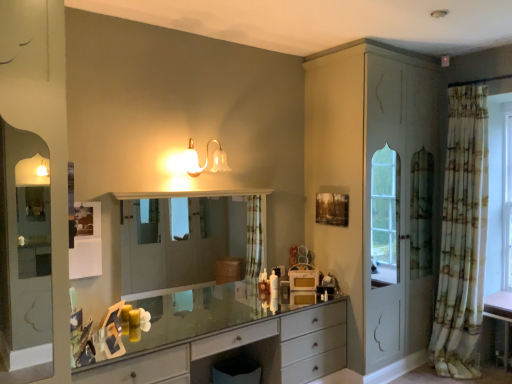
This screenshot has width=512, height=384. In order to click on clear glass mirror at center in this screenshot , I will do 189,241.

Is point (459, 345) positioned before point (181, 352)?

No, (459, 345) is further to viewer.

Which of these two, printed fabric curtain at right or matte gray chest of drawers at center, is thinner?

With smaller width is printed fabric curtain at right.

Can you tell me how much printed fabric curtain at right and matte gray chest of drawers at center differ in facing direction?

89.6 degrees separate the facing orientations of printed fabric curtain at right and matte gray chest of drawers at center.

The height and width of the screenshot is (384, 512). What are the coordinates of `curtain on the right of matte gray chest of drawers at center` in the screenshot? It's located at (462, 236).

Can you confirm if clear glass mirror at center is shorter than matte gray chest of drawers at center?

No.

Is clear glass mirror at center completely or partially outside of matte gray chest of drawers at center?

A: clear glass mirror at center lies outside matte gray chest of drawers at center's area.

Where is `mirror on the left of matte gray chest of drawers at center`? This screenshot has height=384, width=512. mirror on the left of matte gray chest of drawers at center is located at coordinates (189, 241).

Looking at this image, from a real-world perspective, does translucent glass sconce at upper center sit lower than clear glass mirror at center?

No, from a real-world perspective, translucent glass sconce at upper center is not beneath clear glass mirror at center.

At what (x,y) coordinates should I click in order to perform the action: click on mirror below the translucent glass sconce at upper center (from the image's perspective). Please return your answer as a coordinate pair (x, y). This screenshot has width=512, height=384. Looking at the image, I should click on (189, 241).

Is translucent glass sconce at upper center oriented towards clear glass mirror at center?

No, translucent glass sconce at upper center is not facing towards clear glass mirror at center.

Is the position of translucent glass sconce at upper center less distant than that of clear glass mirror at center?

No, translucent glass sconce at upper center is further to the viewer.

Is clear glass mirror at center next to printed fabric curtain at right and touching it?

No.

Is point (139, 235) more distant than point (458, 253)?

Yes, point (139, 235) is farther from viewer.

From the image's perspective, would you say clear glass mirror at center is positioned over printed fabric curtain at right?

No, from the image's perspective, clear glass mirror at center is not above printed fabric curtain at right.

Between clear glass mirror at center and printed fabric curtain at right, which one has smaller size?

→ clear glass mirror at center is smaller.

Is clear glass mirror at center spatially inside translucent glass sconce at upper center, or outside of it?

clear glass mirror at center is located beyond the bounds of translucent glass sconce at upper center.

Can you tell me how much clear glass mirror at center and translucent glass sconce at upper center differ in facing direction?

The angular difference between clear glass mirror at center and translucent glass sconce at upper center is 0.832 degrees.

From the image's perspective, between clear glass mirror at center and translucent glass sconce at upper center, which one is located above?

translucent glass sconce at upper center is shown above in the image.

How distant is clear glass mirror at center from translucent glass sconce at upper center?

4.94 feet.

Based on the photo, which object is thinner, matte gray chest of drawers at center or printed fabric curtain at right?

printed fabric curtain at right is thinner.

Is point (266, 320) positioned in front of point (473, 313)?

Yes.

Is matte gray chest of drawers at center not near printed fabric curtain at right?

Indeed, matte gray chest of drawers at center is not near printed fabric curtain at right.

Is matte gray chest of drawers at center outside of translucent glass sconce at upper center?

Yes.

From the image's perspective, which is below, matte gray chest of drawers at center or translucent glass sconce at upper center?

matte gray chest of drawers at center, from the image's perspective.

The image size is (512, 384). I want to click on chest of drawers on the right of translucent glass sconce at upper center, so click(x=241, y=346).

From the picture: Could you measure the distance between matte gray chest of drawers at center and translucent glass sconce at upper center?

A distance of 4.27 feet exists between matte gray chest of drawers at center and translucent glass sconce at upper center.

Image resolution: width=512 pixels, height=384 pixels. Identify the location of chest of drawers on the left of printed fabric curtain at right. (241, 346).

This screenshot has width=512, height=384. In order to click on mirror positioned vertically above the matte gray chest of drawers at center (from a real-world perspective) in this screenshot , I will do `click(189, 241)`.

Estimate the real-world distances between objects in this image. Which object is further from matte gray chest of drawers at center, translucent glass sconce at upper center or printed fabric curtain at right?

printed fabric curtain at right is further to matte gray chest of drawers at center.

Considering their positions, is printed fabric curtain at right positioned further to matte gray chest of drawers at center than clear glass mirror at center?

Among the two, clear glass mirror at center is located further to matte gray chest of drawers at center.

Considering their positions, is translucent glass sconce at upper center positioned further to clear glass mirror at center than printed fabric curtain at right?

The object further to clear glass mirror at center is printed fabric curtain at right.

Based on their spatial positions, is matte gray chest of drawers at center or printed fabric curtain at right further from translucent glass sconce at upper center?

Among the two, printed fabric curtain at right is located further to translucent glass sconce at upper center.

Which object lies nearer to the anchor point clear glass mirror at center, printed fabric curtain at right or translucent glass sconce at upper center?

Based on the image, translucent glass sconce at upper center appears to be nearer to clear glass mirror at center.

When comparing their distances from printed fabric curtain at right, does translucent glass sconce at upper center or matte gray chest of drawers at center seem closer?

Among the two, matte gray chest of drawers at center is located nearer to printed fabric curtain at right.

Estimate the real-world distances between objects in this image. Which object is closer to matte gray chest of drawers at center, clear glass mirror at center or translucent glass sconce at upper center?

Based on the image, translucent glass sconce at upper center appears to be nearer to matte gray chest of drawers at center.

Consider the image. When comparing their distances from clear glass mirror at center, does translucent glass sconce at upper center or matte gray chest of drawers at center seem closer?

translucent glass sconce at upper center.

The image size is (512, 384). Find the location of `mirror between translucent glass sconce at upper center and printed fabric curtain at right in the horizontal direction`. mirror between translucent glass sconce at upper center and printed fabric curtain at right in the horizontal direction is located at coordinates (189, 241).

At what (x,y) coordinates should I click in order to perform the action: click on mirror between translucent glass sconce at upper center and matte gray chest of drawers at center vertically. Please return your answer as a coordinate pair (x, y). Looking at the image, I should click on (189, 241).

In order to click on chest of drawers between translucent glass sconce at upper center and printed fabric curtain at right in this screenshot , I will do `click(241, 346)`.

Find the location of a particular element. chest of drawers between clear glass mirror at center and printed fabric curtain at right is located at coordinates (241, 346).